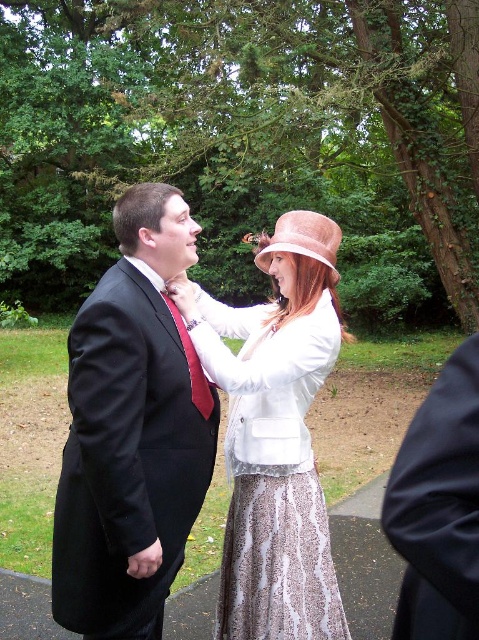
You are a photographer setting up for a group photo. You need to ensure that the matte black suit at center and the light brown felt hat at upper center are both visible in the frame. Given their sizes, which object will require more horizontal space in the composition?

The matte black suit at center requires more horizontal space in the composition because its width surpasses that of the light brown felt hat at upper center.

You are a photographer at the event and need to adjust the camera focus to ensure both the matte black suit at center and the shiny white jacket at center are in focus. Which object should you focus on first to account for their heights?

The matte black suit at center is shorter than the shiny white jacket at center, so you should focus on the shiny white jacket at center first as it is taller and requires adjusting the focus to capture both heights properly.